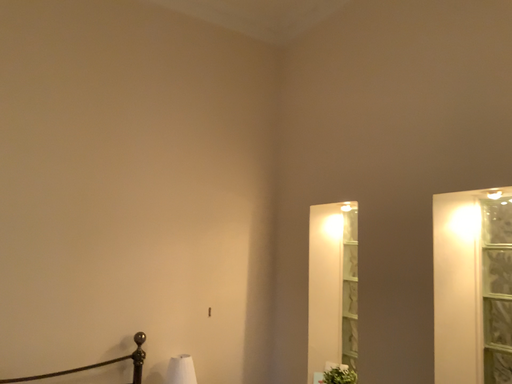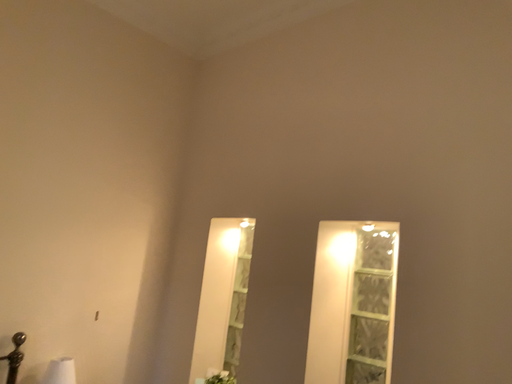
Question: Which way did the camera rotate in the video?

Choices:
 (A) rotated right
 (B) rotated left

Answer: (A)